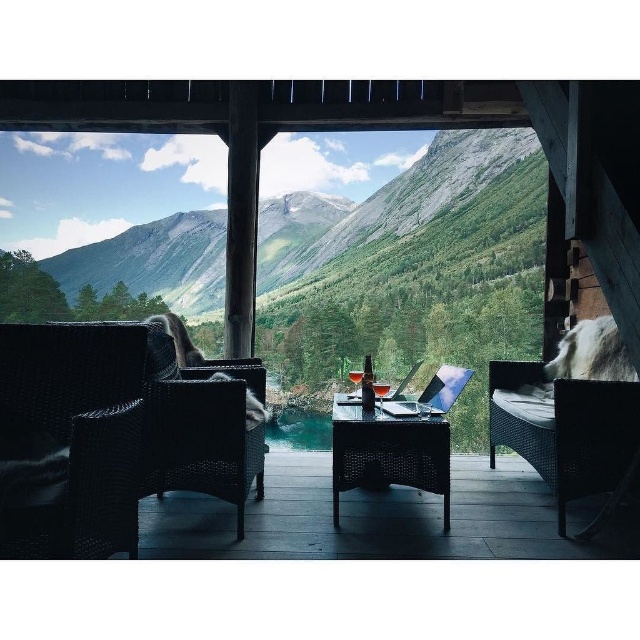
Question: Can you confirm if woven dark brown armchair at left is positioned above woven rattan armchair at right?

Choices:
 (A) no
 (B) yes

Answer: (B)

Question: Which object is positioned farthest from the woven rattan armchair at left?

Choices:
 (A) woven dark brown armchair at left
 (B) woven rattan armchair at right
 (C) rattan table at center

Answer: (B)

Question: Estimate the real-world distances between objects in this image. Which object is closer to the woven rattan armchair at left?

Choices:
 (A) woven rattan armchair at right
 (B) rattan table at center

Answer: (B)

Question: Can you confirm if woven dark brown armchair at left is positioned above woven rattan armchair at right?

Choices:
 (A) no
 (B) yes

Answer: (B)

Question: Which of these objects is positioned farthest from the woven rattan armchair at right?

Choices:
 (A) woven dark brown armchair at left
 (B) rattan table at center
 (C) woven rattan armchair at left

Answer: (A)

Question: Can you confirm if woven rattan armchair at right is wider than rattan table at center?

Choices:
 (A) yes
 (B) no

Answer: (B)